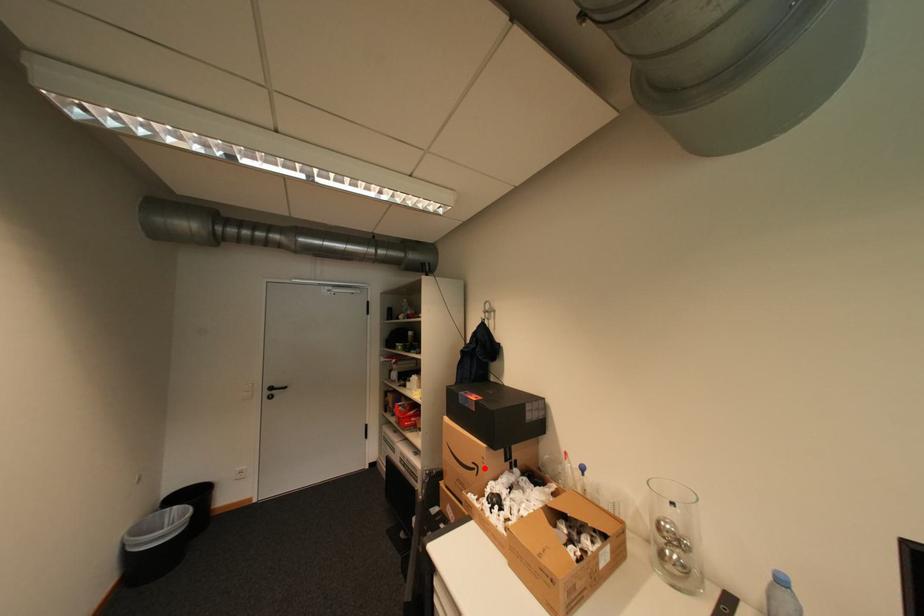
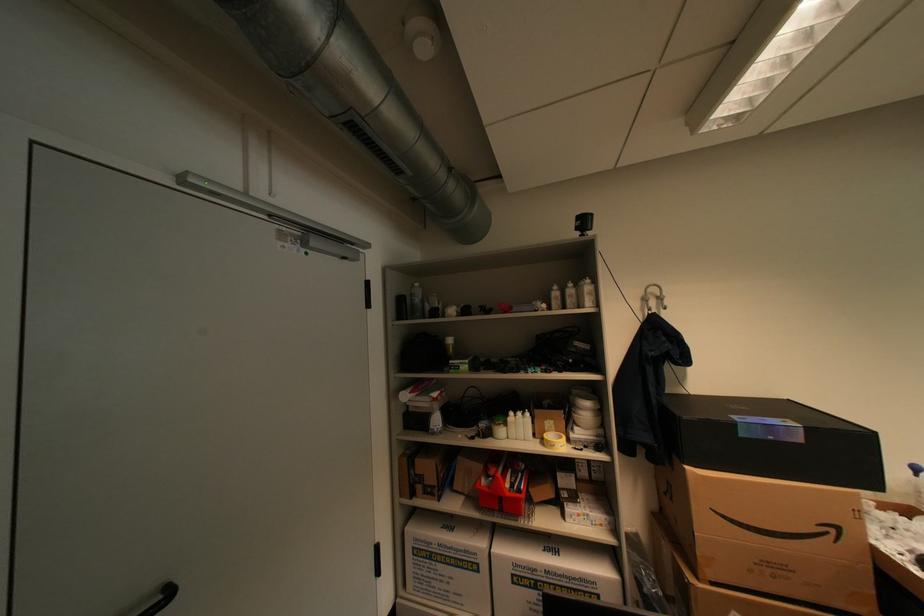
Question: A red point is marked in image1. In image2, is the corresponding 3D point closer to the camera or farther? Reply with the corresponding letter.

Choices:
 (A) The corresponding 3D point is closer.
 (B) The corresponding 3D point is farther.

Answer: (A)